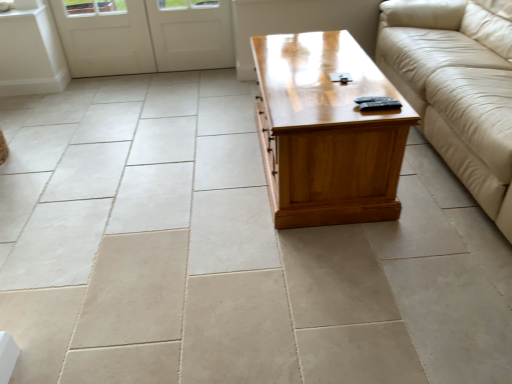
Question: Considering the relative sizes of white matte door at upper left and light brown wood coffee table at center in the image provided, is white matte door at upper left wider than light brown wood coffee table at center?

Choices:
 (A) no
 (B) yes

Answer: (A)

Question: Considering the relative positions of white matte door at upper left and light brown wood coffee table at center in the image provided, is white matte door at upper left to the right of light brown wood coffee table at center from the viewer's perspective?

Choices:
 (A) no
 (B) yes

Answer: (A)

Question: Is white matte door at upper left behind light brown wood coffee table at center?

Choices:
 (A) no
 (B) yes

Answer: (B)

Question: Is white matte door at upper left positioned with its back to light brown wood coffee table at center?

Choices:
 (A) no
 (B) yes

Answer: (A)

Question: Is white matte door at upper left beside light brown wood coffee table at center?

Choices:
 (A) no
 (B) yes

Answer: (A)

Question: From a real-world perspective, is white matte door at upper left beneath light brown wood coffee table at center?

Choices:
 (A) yes
 (B) no

Answer: (B)

Question: Is white matte door at upper left at the back of beige leather couch at right?

Choices:
 (A) no
 (B) yes

Answer: (A)

Question: Is beige leather couch at right in front of white matte door at upper left?

Choices:
 (A) no
 (B) yes

Answer: (B)

Question: From the image's perspective, is beige leather couch at right located beneath white matte door at upper left?

Choices:
 (A) yes
 (B) no

Answer: (A)

Question: Is beige leather couch at right next to white matte door at upper left?

Choices:
 (A) no
 (B) yes

Answer: (A)

Question: Can you confirm if beige leather couch at right is thinner than white matte door at upper left?

Choices:
 (A) no
 (B) yes

Answer: (A)

Question: Is beige leather couch at right at the left side of white matte door at upper left?

Choices:
 (A) yes
 (B) no

Answer: (B)

Question: Is white matte door at upper left thinner than beige leather couch at right?

Choices:
 (A) yes
 (B) no

Answer: (A)